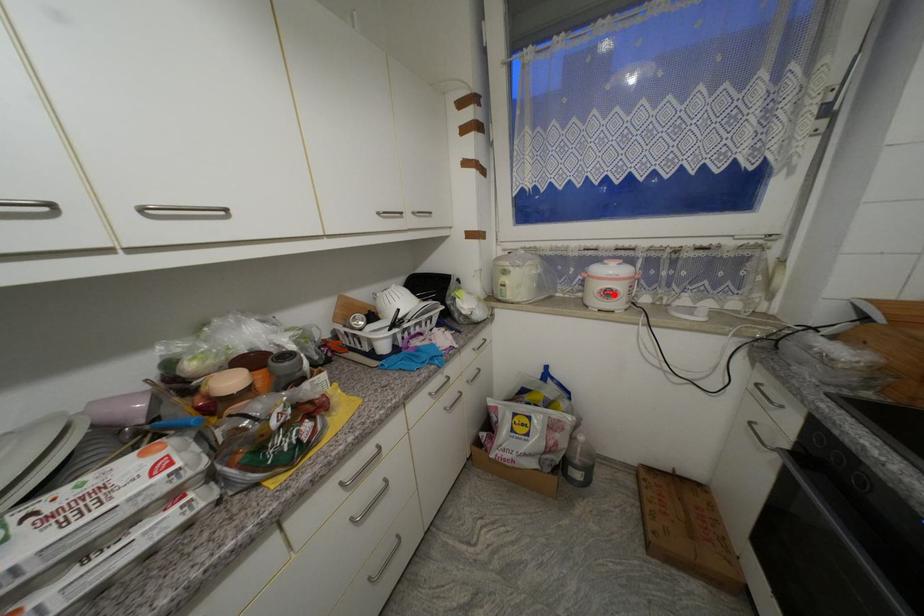
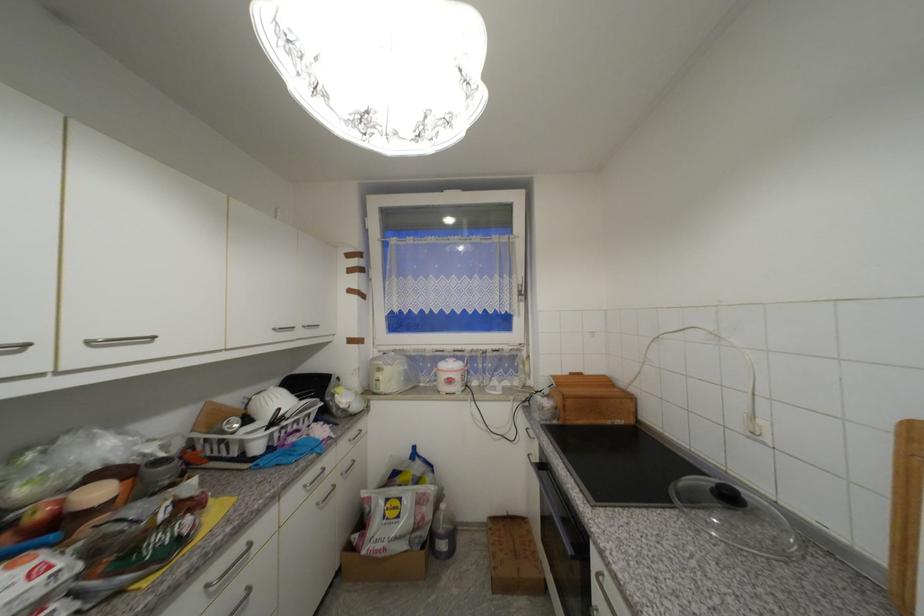
Find the pixel in the second image that matches the highlighted location in the first image.

(456, 382)